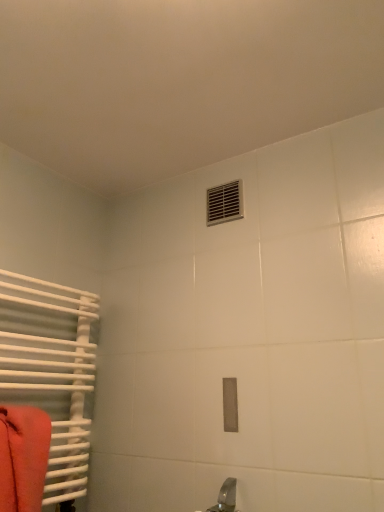
Question: Is metallic silver vent at upper center not within matte orange towel at left?

Choices:
 (A) no
 (B) yes

Answer: (B)

Question: From the image's perspective, is metallic silver vent at upper center located above matte orange towel at left?

Choices:
 (A) yes
 (B) no

Answer: (A)

Question: Can you confirm if metallic silver vent at upper center is positioned to the left of matte orange towel at left?

Choices:
 (A) yes
 (B) no

Answer: (B)

Question: Is metallic silver vent at upper center far away from matte orange towel at left?

Choices:
 (A) no
 (B) yes

Answer: (A)

Question: Is metallic silver vent at upper center wider than matte orange towel at left?

Choices:
 (A) no
 (B) yes

Answer: (A)

Question: Considering the positions of metallic silver vent at upper center and white matte radiator at left in the image, is metallic silver vent at upper center bigger or smaller than white matte radiator at left?

Choices:
 (A) small
 (B) big

Answer: (A)

Question: In terms of width, does metallic silver vent at upper center look wider or thinner when compared to white matte radiator at left?

Choices:
 (A) thin
 (B) wide

Answer: (A)

Question: Is metallic silver vent at upper center taller or shorter than white matte radiator at left?

Choices:
 (A) short
 (B) tall

Answer: (A)

Question: From the image's perspective, is metallic silver vent at upper center positioned above or below white matte radiator at left?

Choices:
 (A) below
 (B) above

Answer: (B)

Question: In terms of width, does white matte radiator at left look wider or thinner when compared to metallic silver vent at upper center?

Choices:
 (A) thin
 (B) wide

Answer: (B)

Question: From their relative heights in the image, would you say white matte radiator at left is taller or shorter than metallic silver vent at upper center?

Choices:
 (A) short
 (B) tall

Answer: (B)

Question: Is white matte radiator at left in front of or behind metallic silver vent at upper center in the image?

Choices:
 (A) behind
 (B) front

Answer: (B)

Question: Which is correct: white matte radiator at left is inside metallic silver vent at upper center, or outside of it?

Choices:
 (A) outside
 (B) inside

Answer: (A)

Question: From the image's perspective, is metallic silver vent at upper center positioned above or below matte orange towel at left?

Choices:
 (A) below
 (B) above

Answer: (B)

Question: Based on their sizes in the image, would you say metallic silver vent at upper center is bigger or smaller than matte orange towel at left?

Choices:
 (A) small
 (B) big

Answer: (A)